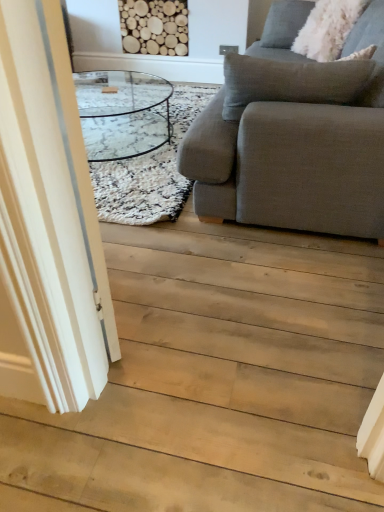
Find the location of `vacant area located to the right-hand side of transparent glass door at left`. vacant area located to the right-hand side of transparent glass door at left is located at coordinates point(199,298).